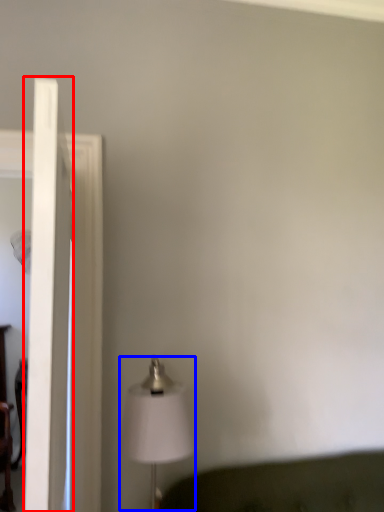
Question: Which object is closer to the camera taking this photo, glass door (highlighted by a red box) or lamp (highlighted by a blue box)?

Choices:
 (A) glass door
 (B) lamp

Answer: (A)